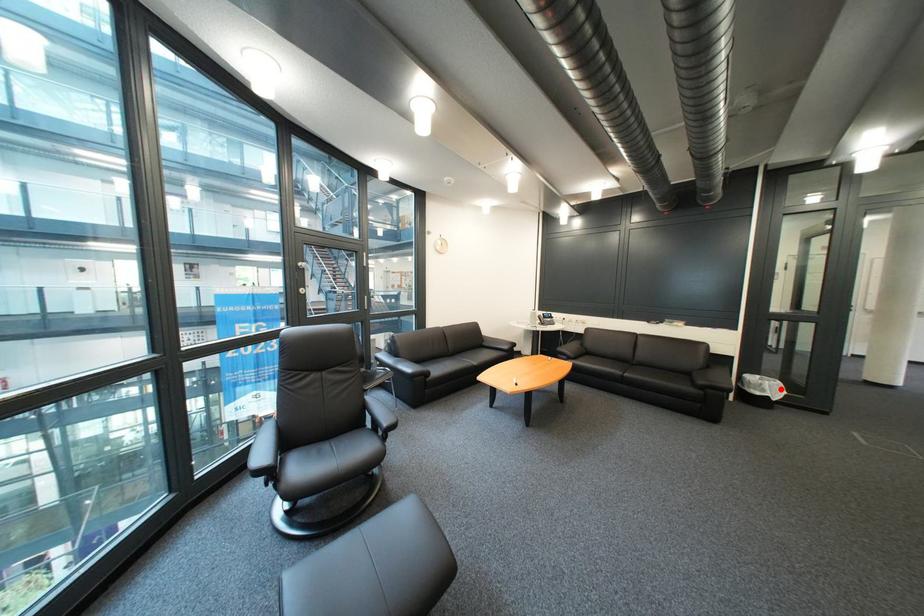
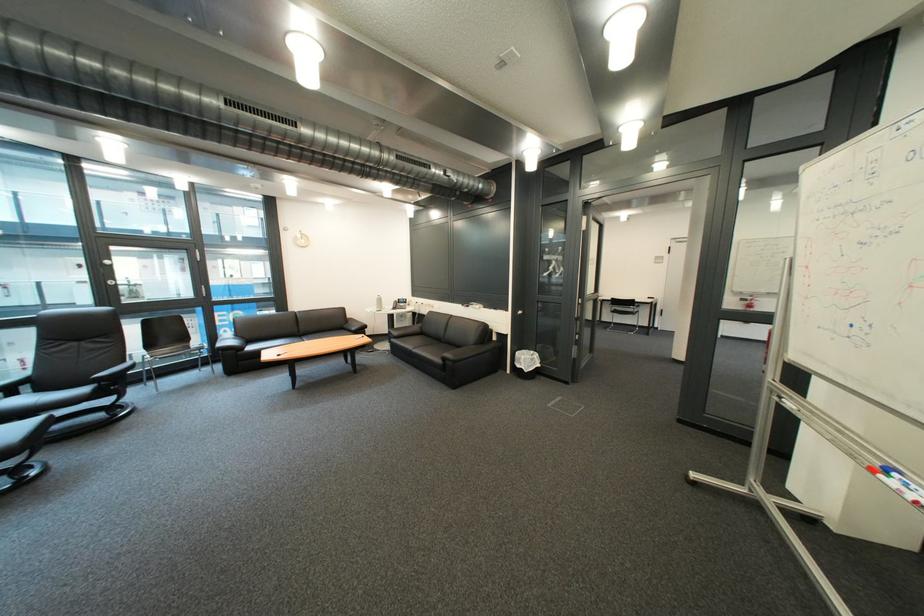
Question: I am providing you with two images of the same scene from different viewpoints. A red point is shown in image1. For the corresponding object point in image2, is it positioned nearer or farther from the camera?

Choices:
 (A) Nearer
 (B) Farther

Answer: (B)